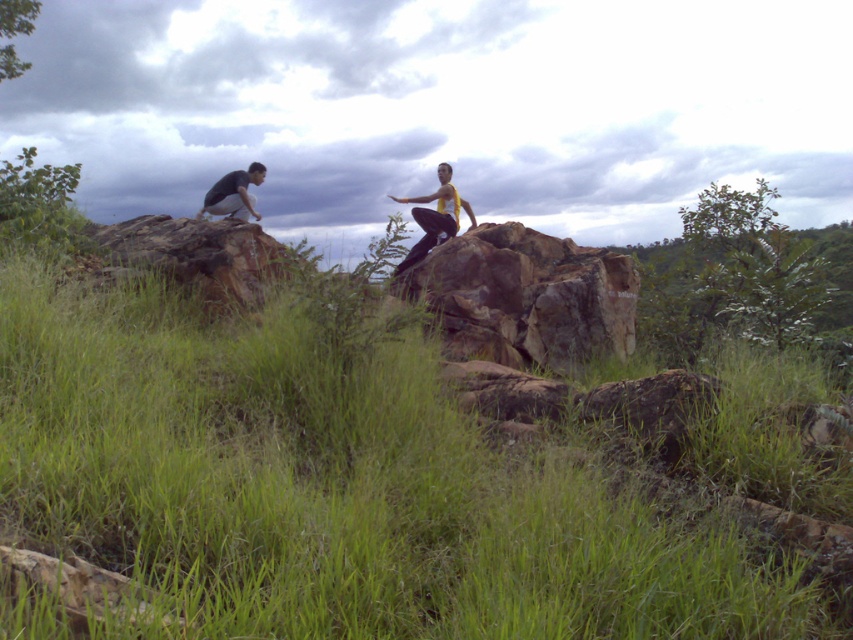
Question: Can you confirm if dark gray stone at center is positioned to the right of yellow matte tank top at center?

Choices:
 (A) yes
 (B) no

Answer: (A)

Question: Which of the following is the farthest from the observer?

Choices:
 (A) yellow matte tank top at center
 (B) dark gray stone at center
 (C) green grassy at center
 (D) brown rough rock at left

Answer: (B)

Question: Does rusty stone at center come behind dark gray stone at center?

Choices:
 (A) yes
 (B) no

Answer: (B)

Question: Which object is closer to the camera taking this photo?

Choices:
 (A) brown rough rock at left
 (B) rusty stone at center
 (C) dark gray fabric shirt at left

Answer: (A)

Question: Which point is farther to the camera?

Choices:
 (A) (222, 179)
 (B) (666, 580)
 (C) (404, 264)
 (D) (508, 234)

Answer: (A)

Question: Considering the relative positions of dark gray stone at center and dark gray fabric shirt at left in the image provided, where is dark gray stone at center located with respect to dark gray fabric shirt at left?

Choices:
 (A) below
 (B) above

Answer: (A)